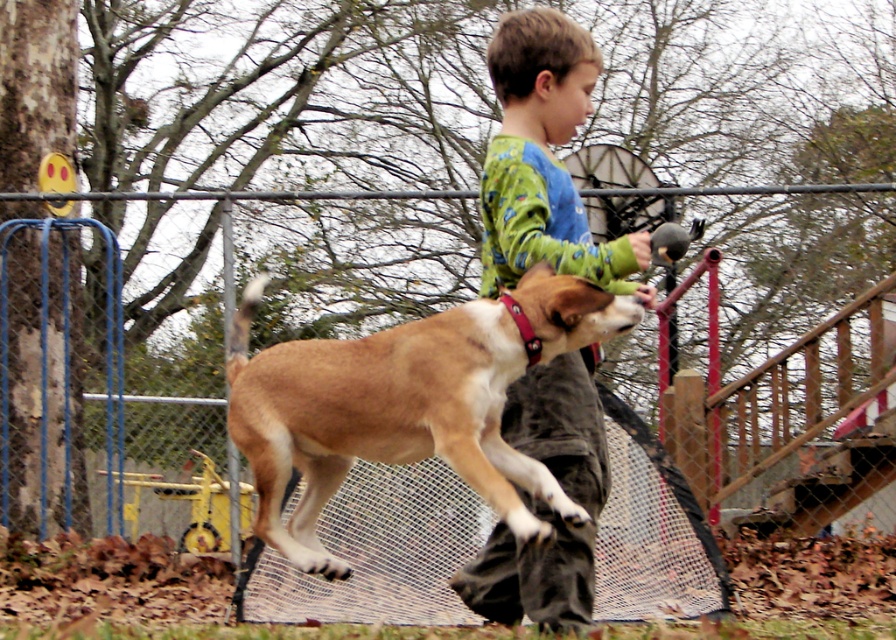
Looking at this image, can you confirm if green/blue fleece shirt at center is positioned below metal mesh fence at center?

No, green/blue fleece shirt at center is not below metal mesh fence at center.

Does green/blue fleece shirt at center appear over metal mesh fence at center?

Yes.

Who is more distant from viewer, (566, 136) or (13, 198)?

The point (13, 198) is more distant.

Locate an element on the screen. The height and width of the screenshot is (640, 896). green/blue fleece shirt at center is located at coordinates (545, 160).

Can you confirm if brown fur dog at center is shorter than metal mesh fence at center?

Incorrect, brown fur dog at center's height does not fall short of metal mesh fence at center's.

Can you confirm if brown fur dog at center is taller than metal mesh fence at center?

Indeed, brown fur dog at center has a greater height compared to metal mesh fence at center.

Does point (384, 408) come closer to viewer compared to point (720, 186)?

Yes, it is in front of point (720, 186).

Where is `brown fur dog at center`? The height and width of the screenshot is (640, 896). brown fur dog at center is located at coordinates (407, 403).

Is brown fur dog at center taller than green/blue fleece shirt at center?

Correct, brown fur dog at center is much taller as green/blue fleece shirt at center.

Is brown fur dog at center positioned before green/blue fleece shirt at center?

Yes, brown fur dog at center is closer to the viewer.

Describe the element at coordinates (407, 403) in the screenshot. I see `brown fur dog at center` at that location.

Where is `brown fur dog at center`? The width and height of the screenshot is (896, 640). brown fur dog at center is located at coordinates (407, 403).